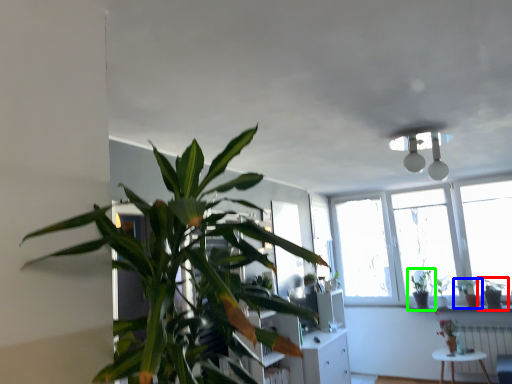
Question: Which object is the farthest from houseplant (highlighted by a red box)? Choose among these: houseplant (highlighted by a blue box) or houseplant (highlighted by a green box).

Choices:
 (A) houseplant
 (B) houseplant

Answer: (B)